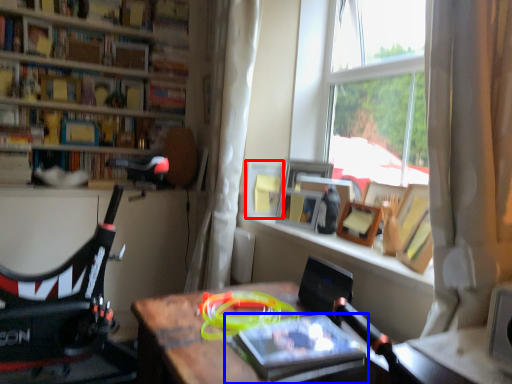
Question: Among these objects, which one is nearest to the camera, picture frame (highlighted by a red box) or book (highlighted by a blue box)?

Choices:
 (A) picture frame
 (B) book

Answer: (B)